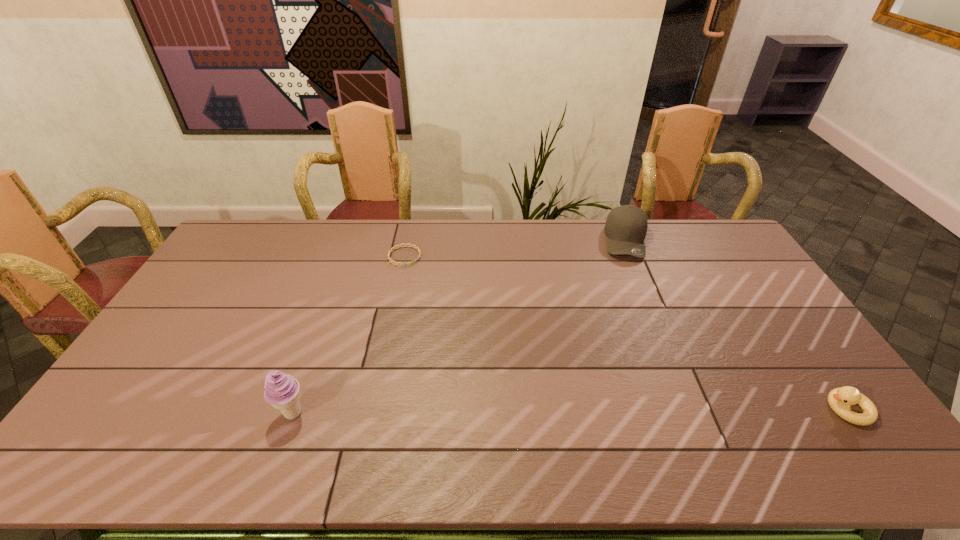
Find the location of a particular element. vacant area situated 0.390m at the beak of the rightmost object is located at coordinates (671, 409).

The height and width of the screenshot is (540, 960). I want to click on vacant area situated 0.120m at the beak of the rightmost object, so click(777, 409).

Locate an element on the screen. This screenshot has width=960, height=540. free space located on the front brim of the second tallest object is located at coordinates (642, 347).

Find the location of a particular element. The width and height of the screenshot is (960, 540). blank area located 0.090m on the front brim of the second tallest object is located at coordinates [633, 278].

I want to click on free region located on the front brim of the second tallest object, so click(x=635, y=288).

Locate an element on the screen. This screenshot has width=960, height=540. free space located on the surface of the shortest object showing star-shaped elements is located at coordinates (435, 283).

Identify the location of vacant space situated on the surface of the shortest object showing star-shaped elements. The width and height of the screenshot is (960, 540). (482, 325).

Where is `free point located 0.360m on the surface of the shortest object showing star-shaped elements`? free point located 0.360m on the surface of the shortest object showing star-shaped elements is located at coordinates pos(478,321).

The width and height of the screenshot is (960, 540). I want to click on baseball cap that is at the far edge, so click(626, 226).

The height and width of the screenshot is (540, 960). Find the location of `bracelet positioned at the far edge`. bracelet positioned at the far edge is located at coordinates (394, 248).